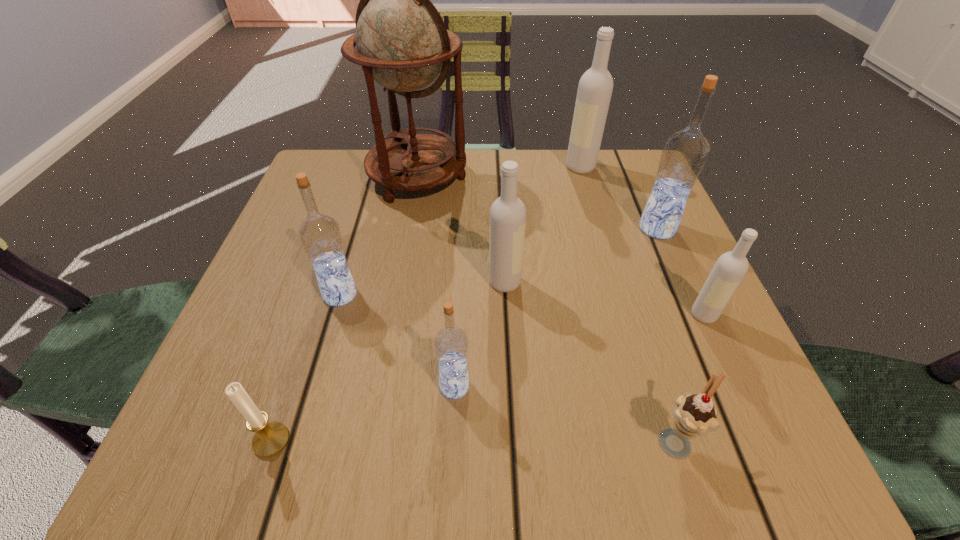
What are the coordinates of `object that ranks as the second closest to the globe` in the screenshot? It's located at (320, 235).

Image resolution: width=960 pixels, height=540 pixels. I want to click on object that is the closest to the rightmost blue vodka, so click(595, 87).

Identify the location of vodka that stands as the third closest to the icecream. (507, 224).

Find the location of `vodka that is the second closest to the second farthest blue vodka`. vodka that is the second closest to the second farthest blue vodka is located at coordinates (507, 224).

Identify the location of white vodka identified as the third closest to the seventh nearest object. (507, 224).

Identify which white vodka is the second nearest to the nearest white vodka. Please provide its 2D coordinates. Your answer should be formatted as a tuple, i.e. [(x, y)], where the tuple contains the x and y coordinates of a point satisfying the conditions above.

[(595, 87)]

Point out which blue vodka is positioned as the third nearest to the tallest object. Please provide its 2D coordinates. Your answer should be formatted as a tuple, i.e. [(x, y)], where the tuple contains the x and y coordinates of a point satisfying the conditions above.

[(451, 344)]

You are a GUI agent. You are given a task and a screenshot of the screen. Output one action in this format:
    pyautogui.click(x=<x>, y=<y>)
    Task: Click on the blue vodka that stands as the second closest to the nearest blue vodka
    The width and height of the screenshot is (960, 540).
    Given the screenshot: What is the action you would take?
    pyautogui.click(x=684, y=153)

You are a GUI agent. You are given a task and a screenshot of the screen. Output one action in this format:
    pyautogui.click(x=<x>, y=<y>)
    Task: Click on the vacant space that satisfies the following two spatial constraints: 1. on the front side of the fifth object from right to left; 2. on the left side of the icecream
    This screenshot has height=540, width=960.
    Given the screenshot: What is the action you would take?
    pyautogui.click(x=513, y=440)

I want to click on vacant space that satisfies the following two spatial constraints: 1. on the surface of the second blue vodka from right to left; 2. on the right side of the globe, so click(382, 386).